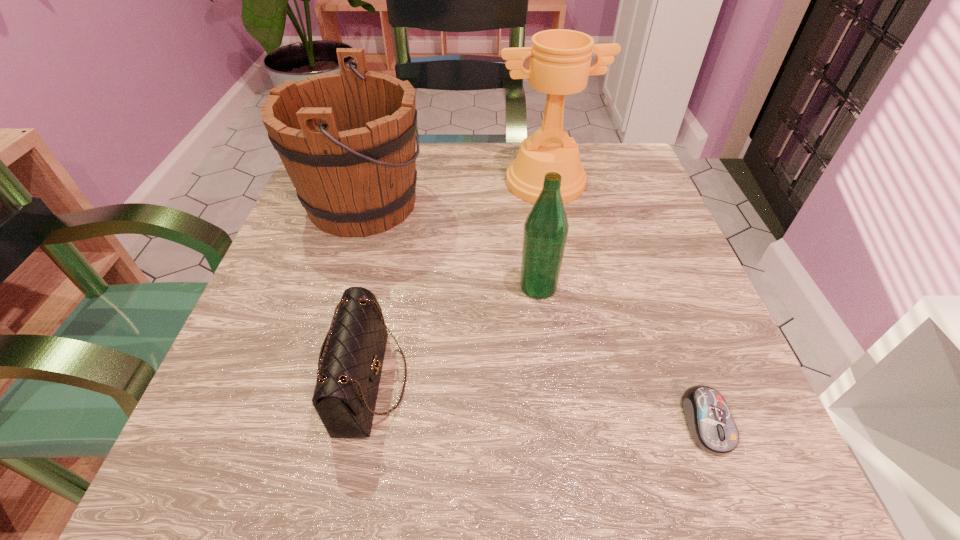
The height and width of the screenshot is (540, 960). In order to click on award in this screenshot , I will do `click(560, 59)`.

Image resolution: width=960 pixels, height=540 pixels. Identify the location of wine bucket. (347, 139).

Identify the location of the third farthest object. This screenshot has width=960, height=540. 546,227.

Where is `bottle`? The image size is (960, 540). bottle is located at coordinates (546, 227).

I want to click on the fourth tallest object, so click(350, 363).

The image size is (960, 540). In order to click on the shortest object in this screenshot , I will do `click(710, 423)`.

Locate an element on the screen. computer mouse is located at coordinates (710, 423).

I want to click on free space located on the front of the award, so click(564, 291).

Where is `vacant space located on the side of the wine bucket with the handle for carrying`? This screenshot has width=960, height=540. vacant space located on the side of the wine bucket with the handle for carrying is located at coordinates (558, 203).

Identify the location of vacant area situated on the left of the third tallest object. (288, 287).